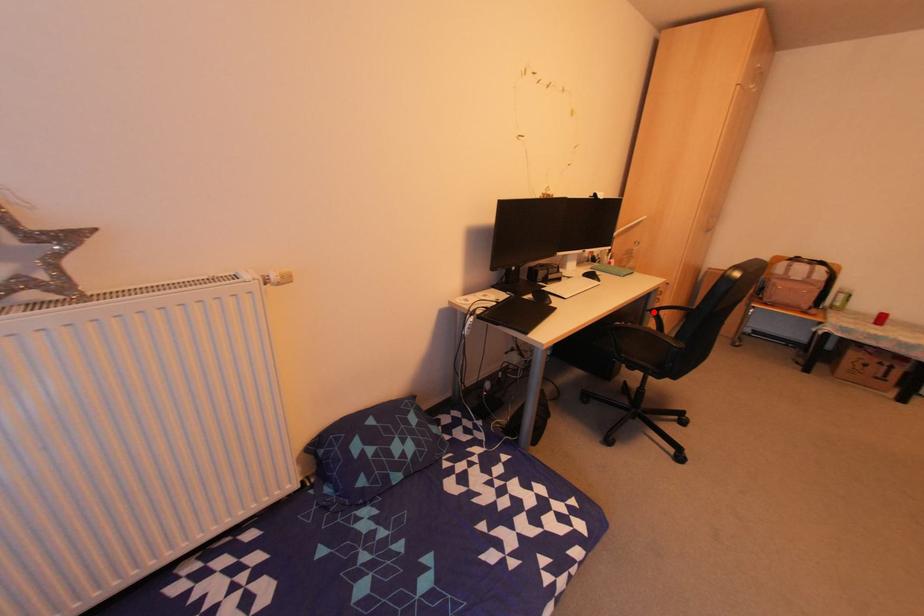
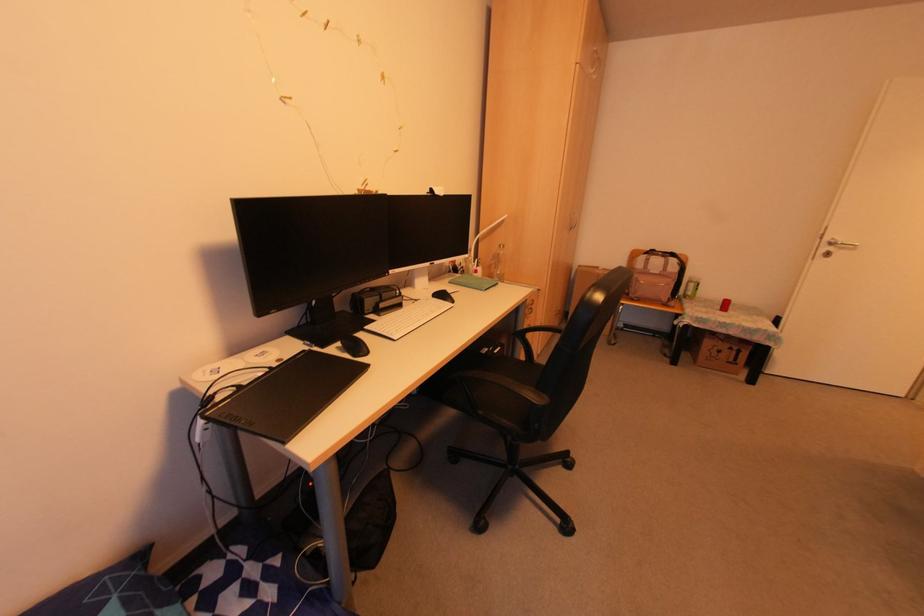
Question: I am providing you with two images of the same scene from different viewpoints. Given a red point in image1, look at the same physical point in image2. Is it:

Choices:
 (A) Closer to the viewpoint
 (B) Farther from the viewpoint

Answer: (B)